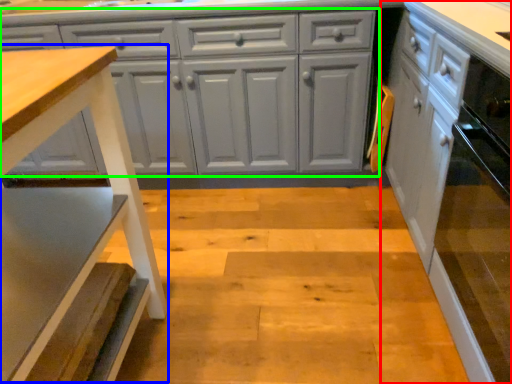
Question: Based on their relative distances, which object is farther from cabinetry (highlighted by a red box)? Choose from step stool (highlighted by a blue box) and cabinetry (highlighted by a green box).

Choices:
 (A) step stool
 (B) cabinetry

Answer: (A)